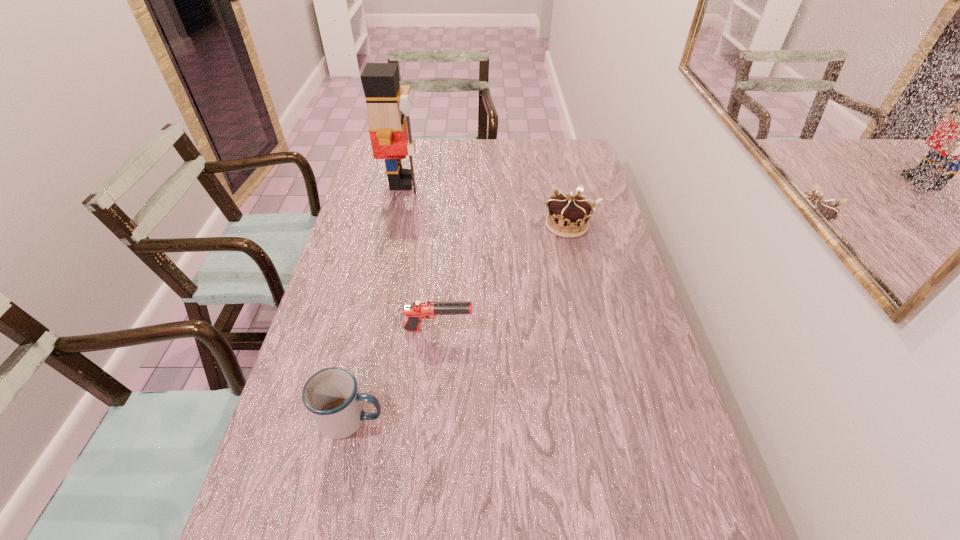
Find the location of `the tallest object`. the tallest object is located at coordinates (388, 105).

Locate an element on the screen. The image size is (960, 540). the farthest object is located at coordinates (388, 105).

This screenshot has width=960, height=540. What are the coordinates of `the third nearest object` in the screenshot? It's located at (568, 215).

Find the location of a particular element. Image resolution: width=960 pixels, height=540 pixels. the rightmost object is located at coordinates (568, 215).

Where is `mug`? mug is located at coordinates (331, 395).

Where is `the second nearest object`? The width and height of the screenshot is (960, 540). the second nearest object is located at coordinates (417, 311).

The width and height of the screenshot is (960, 540). Find the location of `the third object from left to right`. the third object from left to right is located at coordinates (417, 311).

Image resolution: width=960 pixels, height=540 pixels. What are the coordinates of `vacant space located 0.120m in front of the nutcracker holding the staff` in the screenshot? It's located at (456, 182).

Find the location of a particular element. Image resolution: width=960 pixels, height=540 pixels. vacant space located 0.200m on the left of the second farthest object is located at coordinates (478, 225).

At what (x,y) coordinates should I click in order to perform the action: click on vacant position located 0.220m on the handle side of the mug. Please return your answer as a coordinate pair (x, y). This screenshot has width=960, height=540. Looking at the image, I should click on (483, 420).